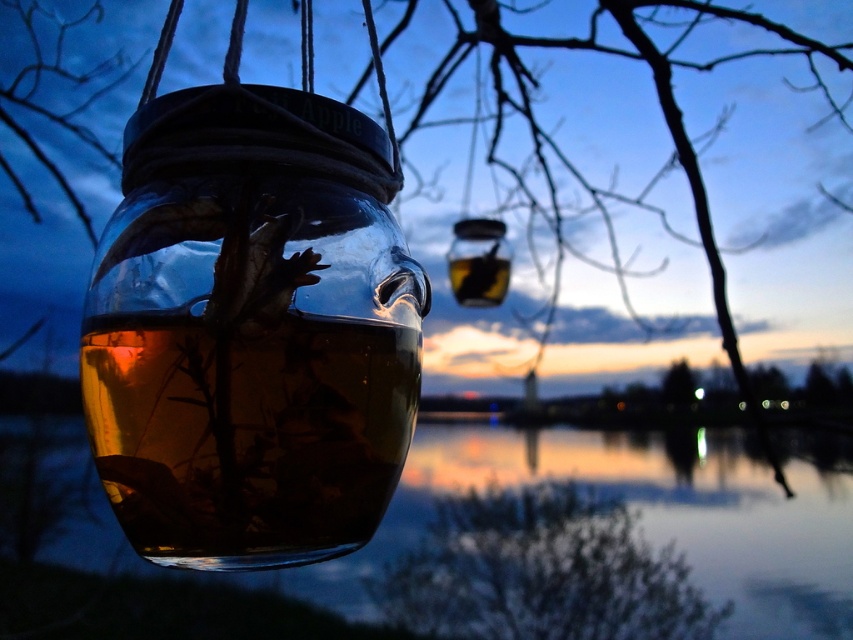
You are an observer looking at the jars. Which object, the transparent liquid water at jar left or the brown textured tree at lower center, appears taller in the scene?

The transparent liquid water at jar left appears taller than the brown textured tree at lower center in the scene.

You are an artist planning to paint the scene. You want to ensure the sizes of the transparent glass jar at center and the brown textured tree at lower center are proportionally accurate. Which object should you paint larger?

The transparent glass jar at center should be painted larger than the brown textured tree at lower center because the description states it is bigger.